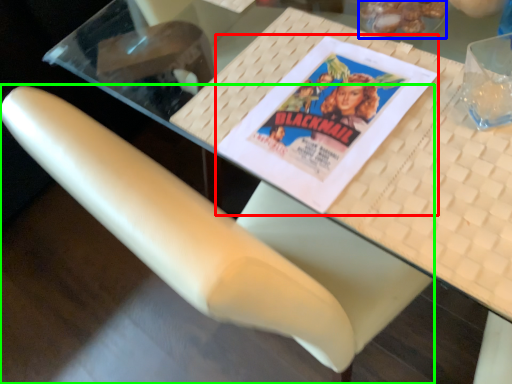
Question: Estimate the real-world distances between objects in this image. Which object is farther from paperback book (highlighted by a red box), food (highlighted by a blue box) or chair (highlighted by a green box)?

Choices:
 (A) food
 (B) chair

Answer: (B)